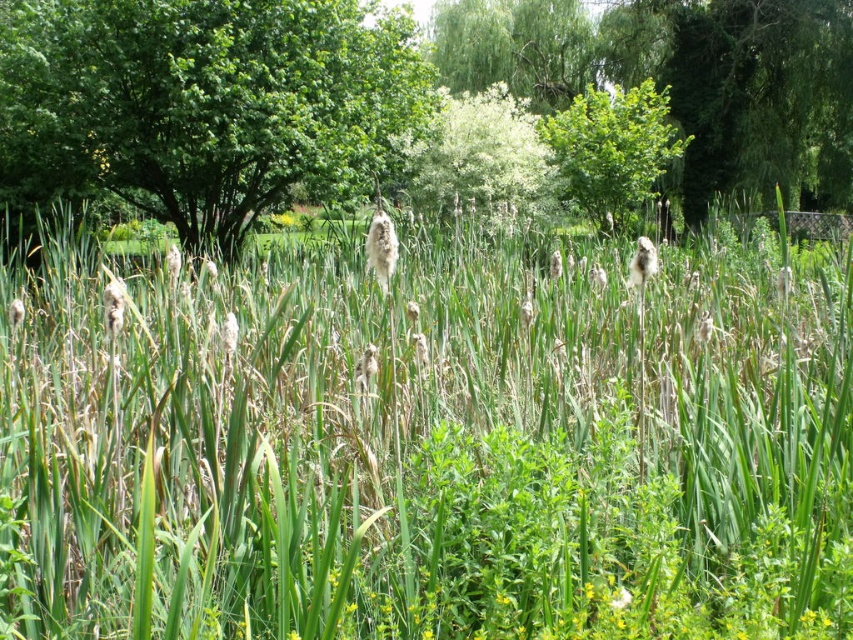
You are standing at the center of the image and want to locate the green leafy tree at upper left. Based on its coordinates, in which direction should you look to find it?

The green leafy tree at upper left is located at coordinates point (x=204, y=102), which is to the upper left direction from the center of the image.

You are standing in the lush green natural setting described. You need to place a small marker exactly at the center of the image. Is the green grass at center closer to the marker or farther away than the marker?

The green grass at center is located at point (426, 440), which is slightly offset from the exact center of the image. Therefore, it is farther away from the marker placed at the center than the marker itself.